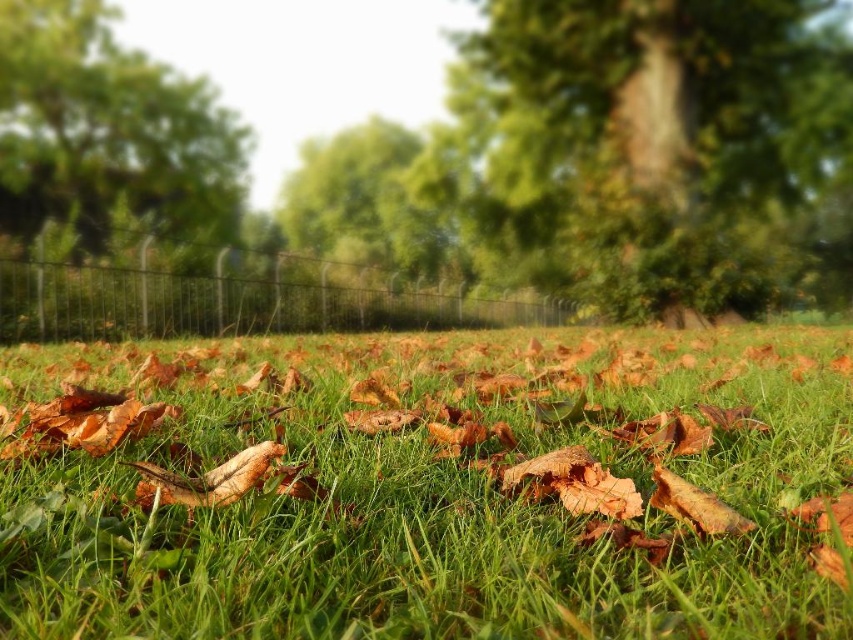
Which of these two, green grassy at center or green textured tree at upper center, stands taller?

green textured tree at upper center

Can you confirm if green grassy at center is positioned above green textured tree at upper center?

Actually, green grassy at center is below green textured tree at upper center.

Where is `green grassy at center`? green grassy at center is located at coordinates (436, 488).

In order to click on green grassy at center in this screenshot , I will do `click(436, 488)`.

Can you confirm if green textured tree at upper center is positioned to the right of black wire fence at center?

Correct, you'll find green textured tree at upper center to the right of black wire fence at center.

Is green textured tree at upper center wider than black wire fence at center?

Correct, the width of green textured tree at upper center exceeds that of black wire fence at center.

Who is more forward, (595,38) or (108,324)?

Point (108,324) is more forward.

At what (x,y) coordinates should I click in order to perform the action: click on green textured tree at upper center. Please return your answer as a coordinate pair (x, y). The width and height of the screenshot is (853, 640). Looking at the image, I should click on (651, 148).

Consider the image. Can you confirm if green textured tree at upper center is positioned above green leafy tree at upper left?

Yes, green textured tree at upper center is above green leafy tree at upper left.

Is green textured tree at upper center shorter than green leafy tree at upper left?

No, green textured tree at upper center is not shorter than green leafy tree at upper left.

Find the location of a particular element. The width and height of the screenshot is (853, 640). green textured tree at upper center is located at coordinates (651, 148).